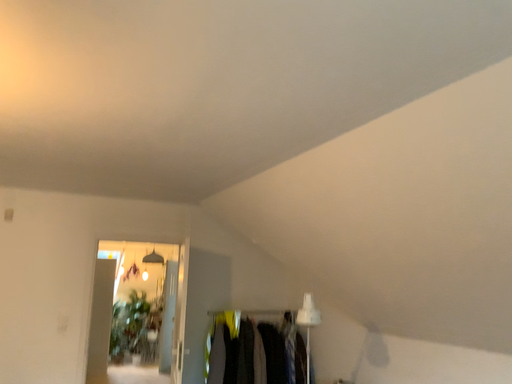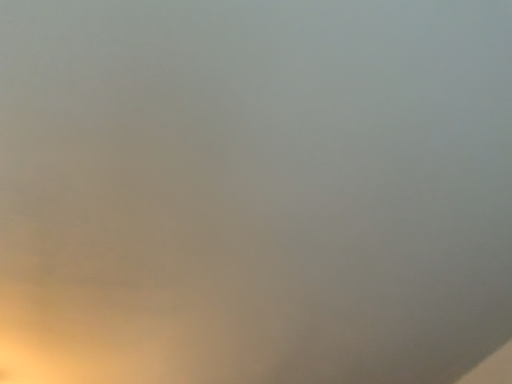
Question: Which way did the camera rotate in the video?

Choices:
 (A) rotated upward
 (B) rotated downward

Answer: (A)